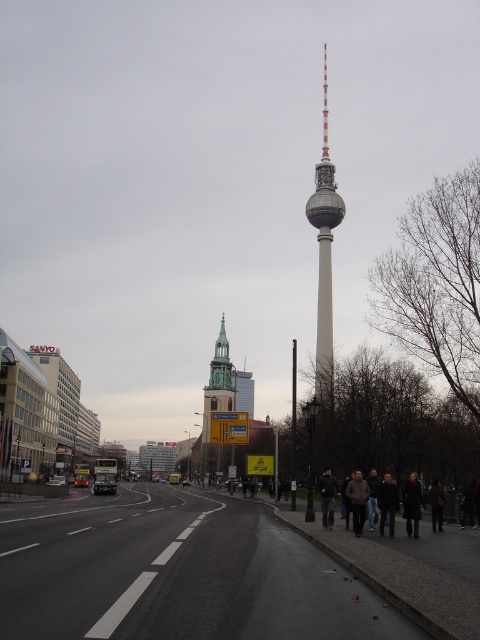
Can you confirm if white smooth tower at center is smaller than green stone church steeple at center?

Actually, white smooth tower at center might be larger than green stone church steeple at center.

The width and height of the screenshot is (480, 640). Describe the element at coordinates (324, 256) in the screenshot. I see `white smooth tower at center` at that location.

Identify the location of white smooth tower at center. (324, 256).

Which of these two, green stone church steeple at center or dark gray jacket at center, stands taller?

With more height is green stone church steeple at center.

I want to click on green stone church steeple at center, so click(217, 384).

Is point (333, 189) in front of point (420, 492)?

No, it is not.

Between white smooth tower at center and dark brown leather coat at lower right, which one has more height?

With more height is white smooth tower at center.

Is point (332, 209) positioned after point (409, 534)?

Yes, it is.

I want to click on white smooth tower at center, so click(x=324, y=256).